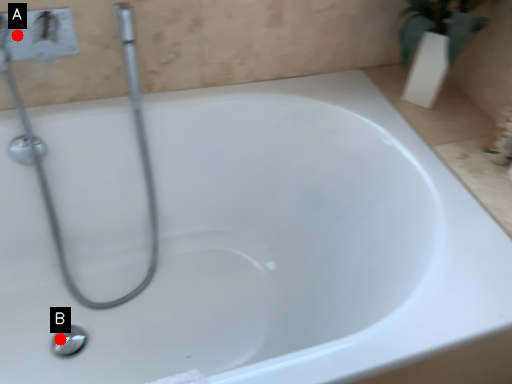
Question: Two points are circled on the image, labeled by A and B beside each circle. Which point is closer to the camera?

Choices:
 (A) A is closer
 (B) B is closer

Answer: (A)